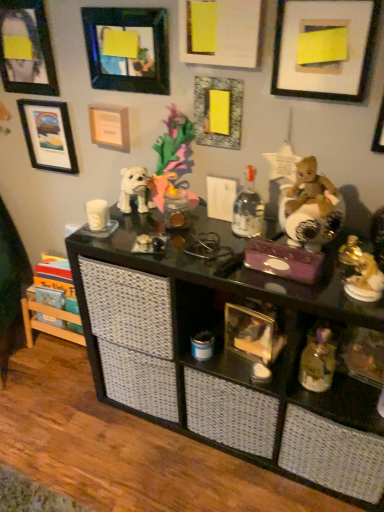
At what (x,y) coordinates should I click in order to perform the action: click on free space behind gold metallic figurine at right, acting as the second toy starting from the top. Please return your answer as a coordinate pair (x, y). Looking at the image, I should click on point(345,242).